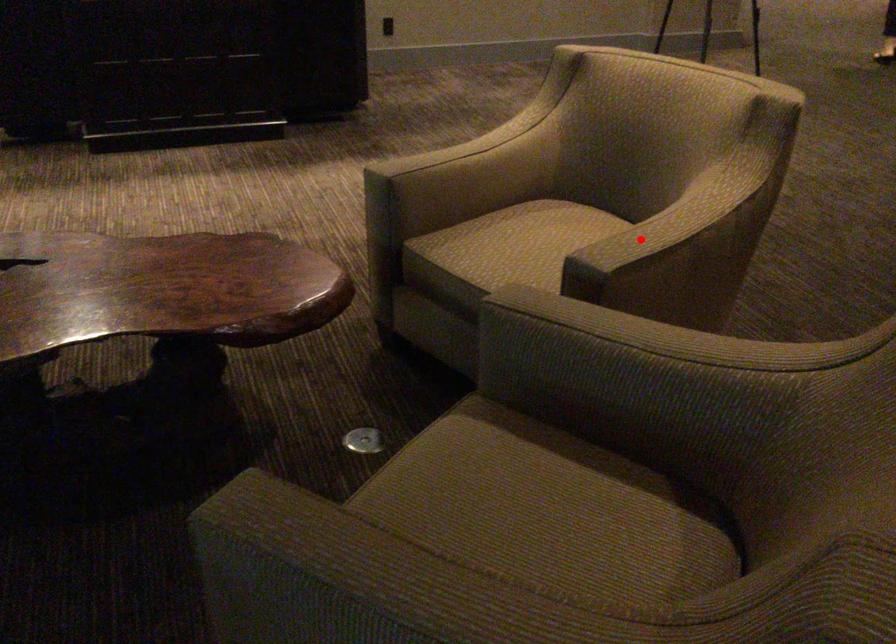
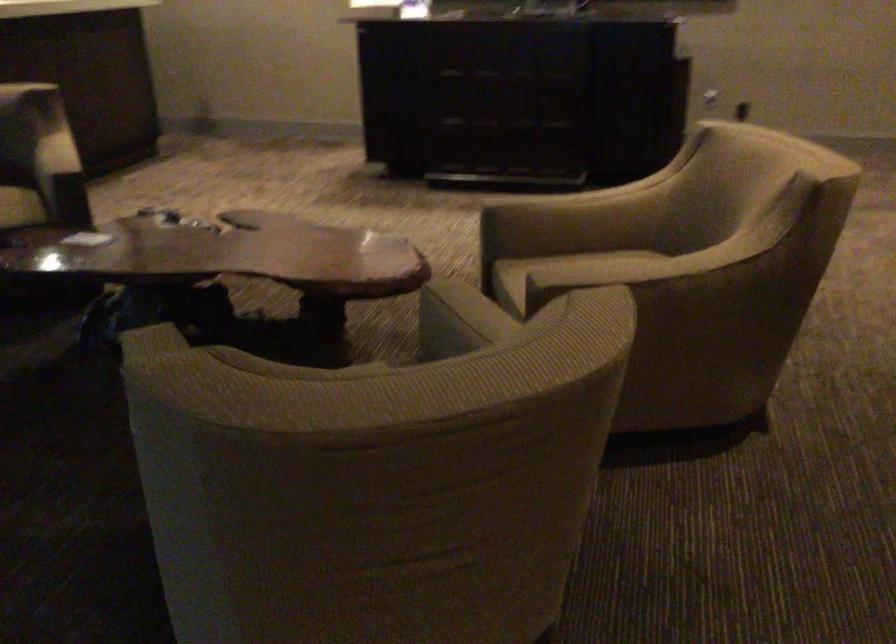
Question: I am providing you with two images of the same scene from different viewpoints. Given a red point in image1, look at the same physical point in image2. Is it:

Choices:
 (A) Closer to the viewpoint
 (B) Farther from the viewpoint

Answer: (B)